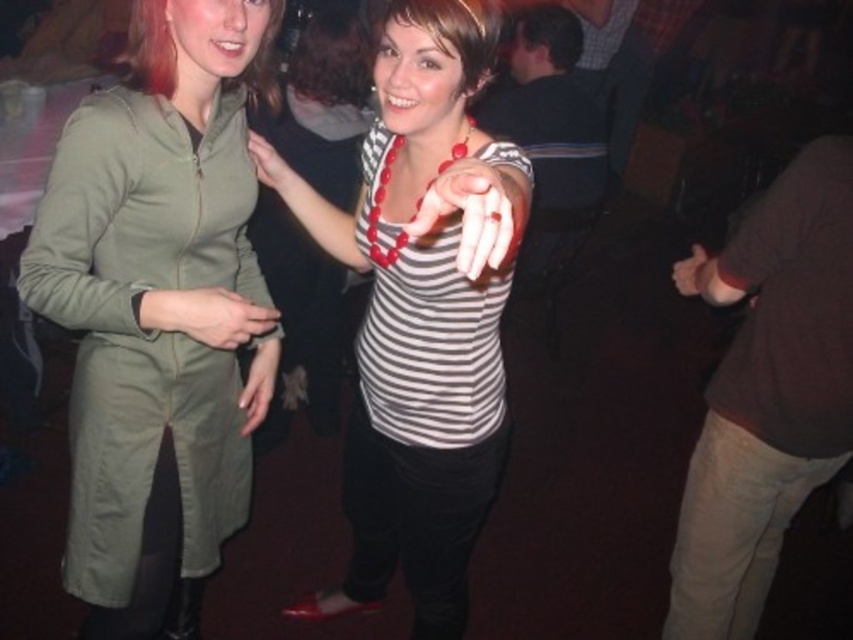
Question: In this image, where is matte red beaded necklace at center located relative to matte green jacket at upper left?

Choices:
 (A) left
 (B) right

Answer: (B)

Question: Which point is farther from the camera taking this photo?

Choices:
 (A) (219, 385)
 (B) (525, 218)
 (C) (697, 260)

Answer: (C)

Question: Can you confirm if matte green jacket at upper left is smaller than matte black hand at center?

Choices:
 (A) no
 (B) yes

Answer: (B)

Question: Which of these objects is positioned closest to the matte green jacket at upper left?

Choices:
 (A) matte green jacket at center
 (B) olive green fabric jacket at left

Answer: (A)

Question: Which of the following is the closest to the observer?

Choices:
 (A) dark brown sweater at right
 (B) matte red beaded necklace at center
 (C) striped jersey at center
 (D) olive green fabric jacket at left

Answer: (B)

Question: Where is matte green jacket at center located in relation to matte black hand at center in the image?

Choices:
 (A) above
 (B) below

Answer: (B)